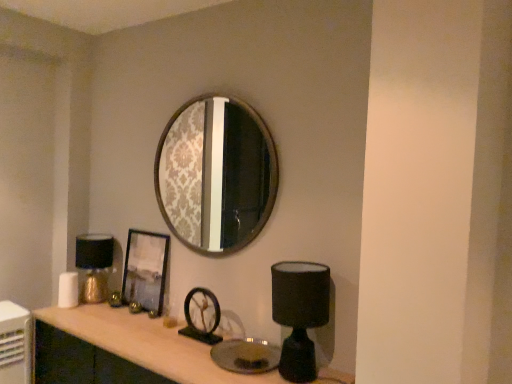
Where is `vacant space situated above wooden frame mirror at upper center (from a real-world perspective)`? vacant space situated above wooden frame mirror at upper center (from a real-world perspective) is located at coordinates (202, 89).